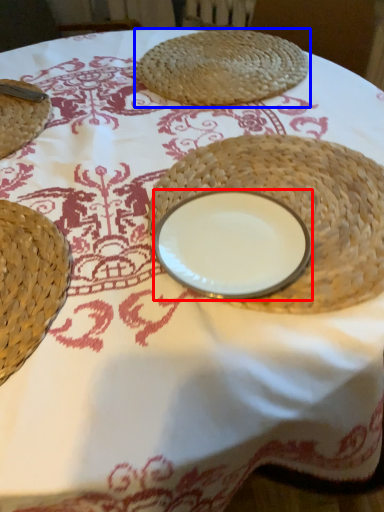
Question: Which object appears closest to the camera in this image, tableware (highlighted by a red box) or food (highlighted by a blue box)?

Choices:
 (A) tableware
 (B) food

Answer: (A)